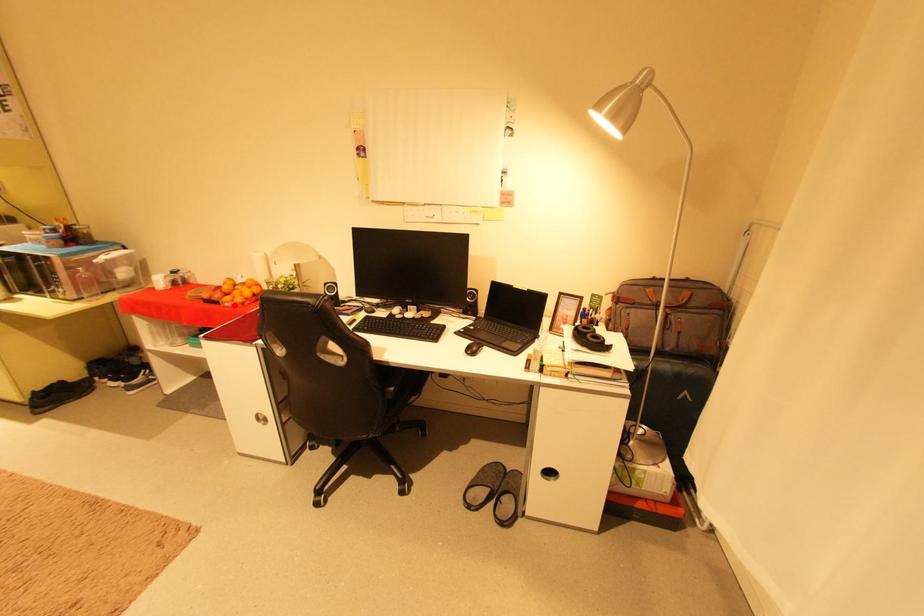
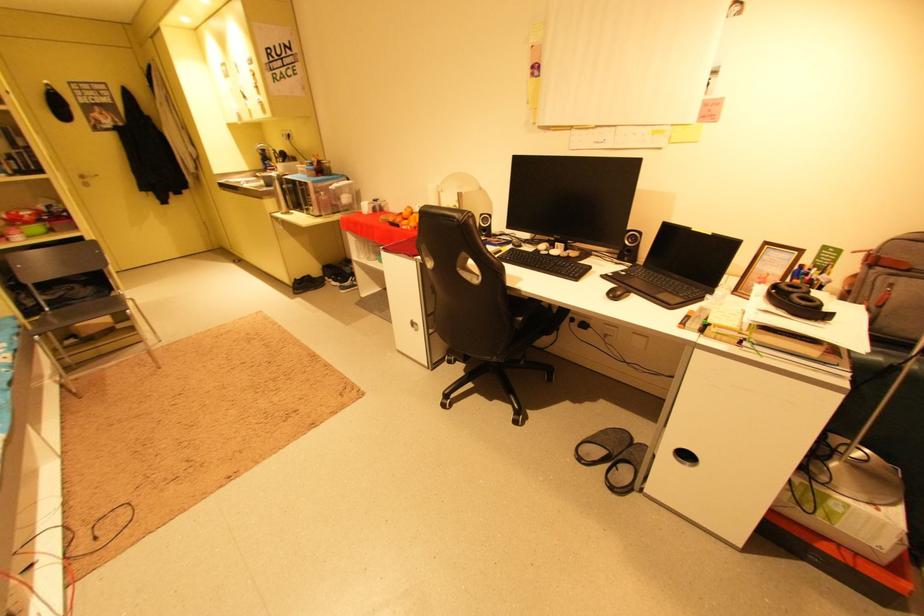
Where in the second image is the point corresponding to the highlighted location from the first image?

(410, 228)